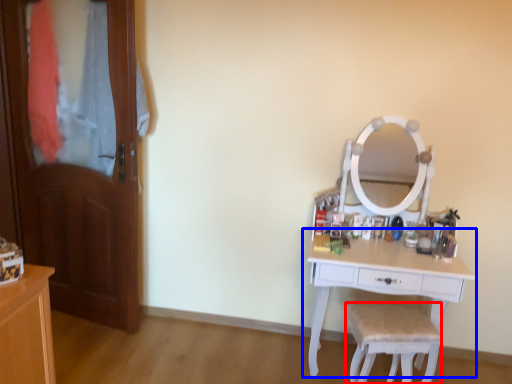
Question: Which object is further to the camera taking this photo, chair (highlighted by a red box) or table (highlighted by a blue box)?

Choices:
 (A) chair
 (B) table

Answer: (B)